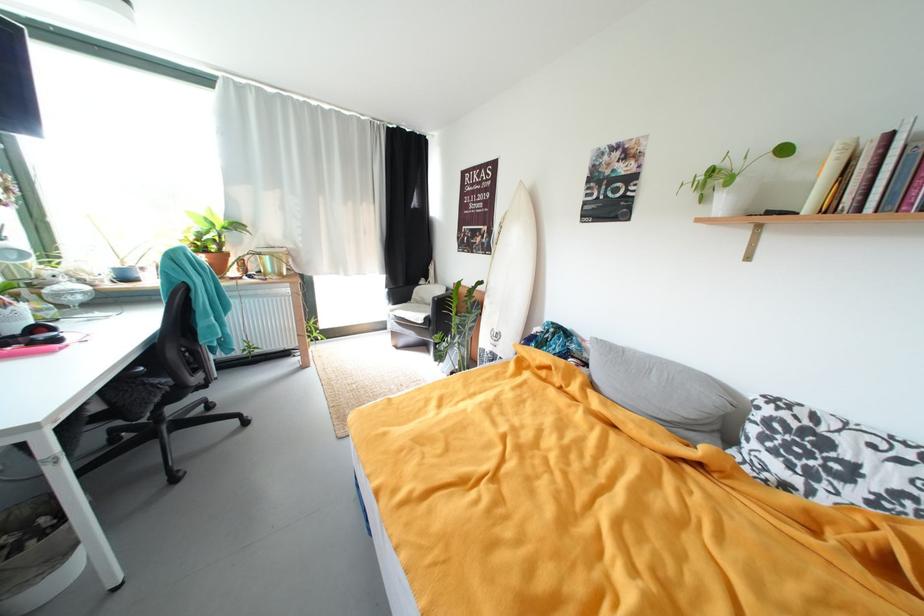
The width and height of the screenshot is (924, 616). In order to click on chair sitting surface in this screenshot , I will do `click(412, 313)`.